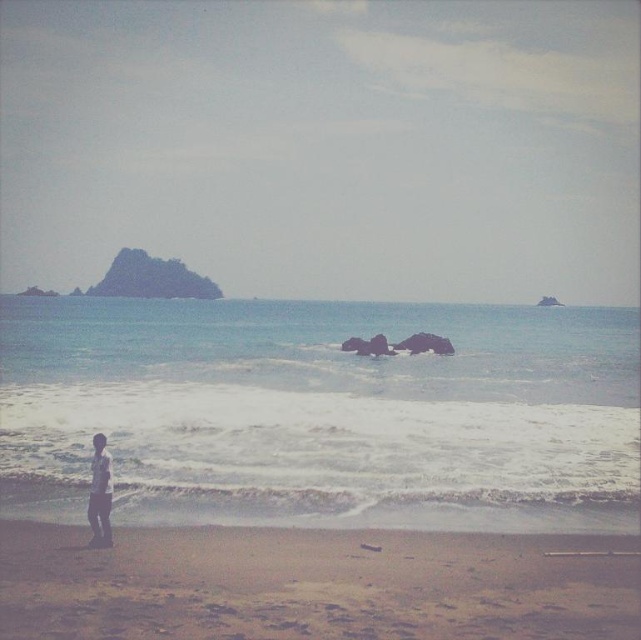
You are standing at the shoreline and want to walk to the clear blue water at lower center. Which direction should you go relative to the brown sandy beach at lower center?

Since the brown sandy beach at lower center is behind the clear blue water at lower center, you should walk towards the clear blue water at lower center, which is in front of the brown sandy beach at lower center.

You are a photographer standing at the beach and want to capture both point [576,556] and point [96,497] in your photo. Which point is closer to your camera?

Point [96,497] is closer to the camera than point [576,556].